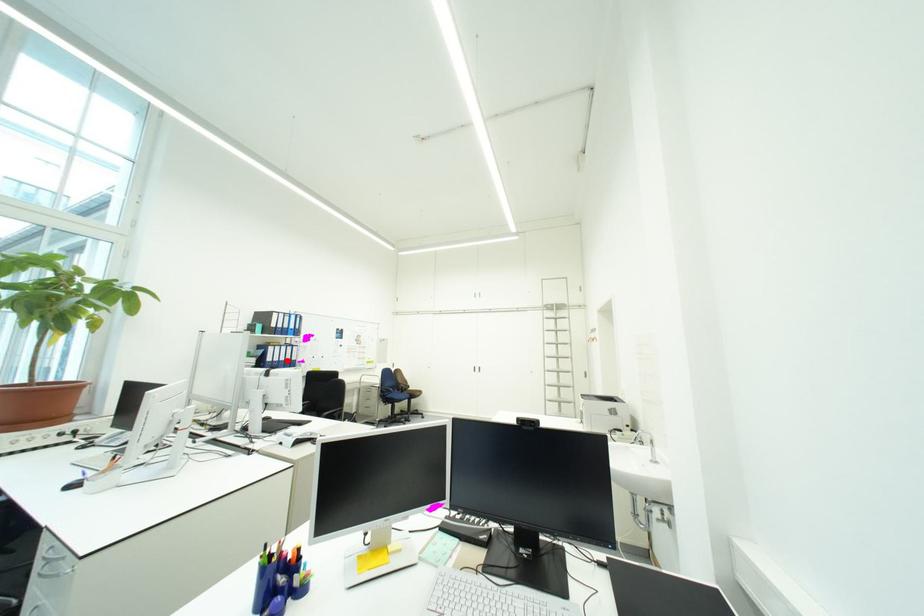
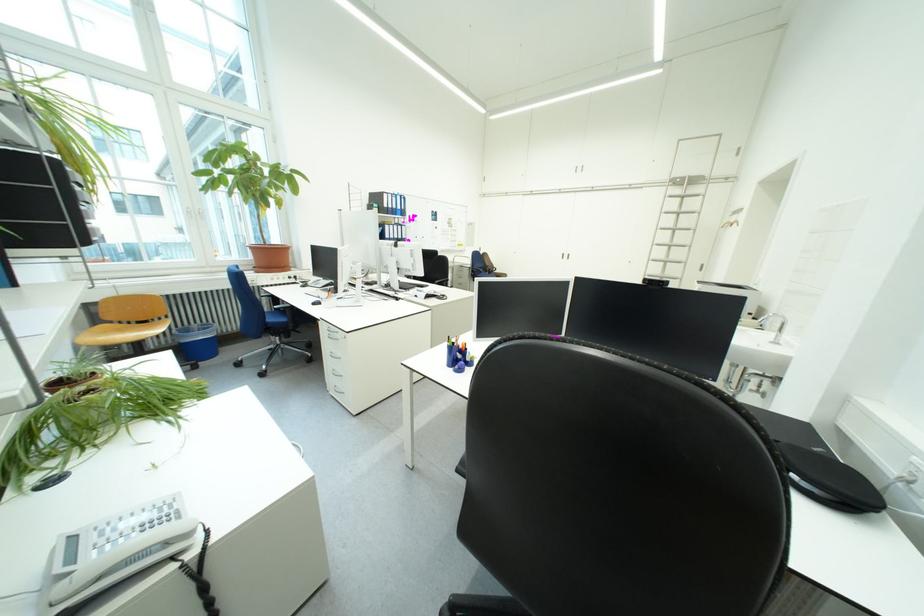
Find the pixel in the second image that matches the highlighted location in the first image.

(403, 238)